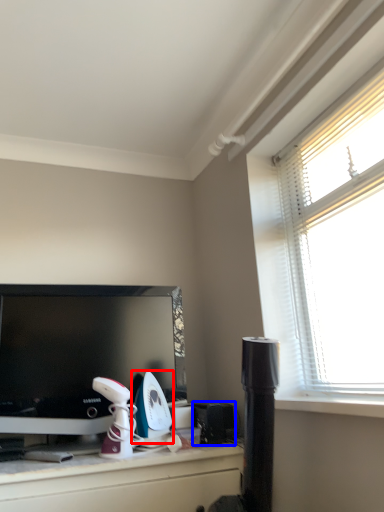
Question: Which of the following is the closest to the observer, appliance (highlighted by a red box) or appliance (highlighted by a blue box)?

Choices:
 (A) appliance
 (B) appliance

Answer: (A)